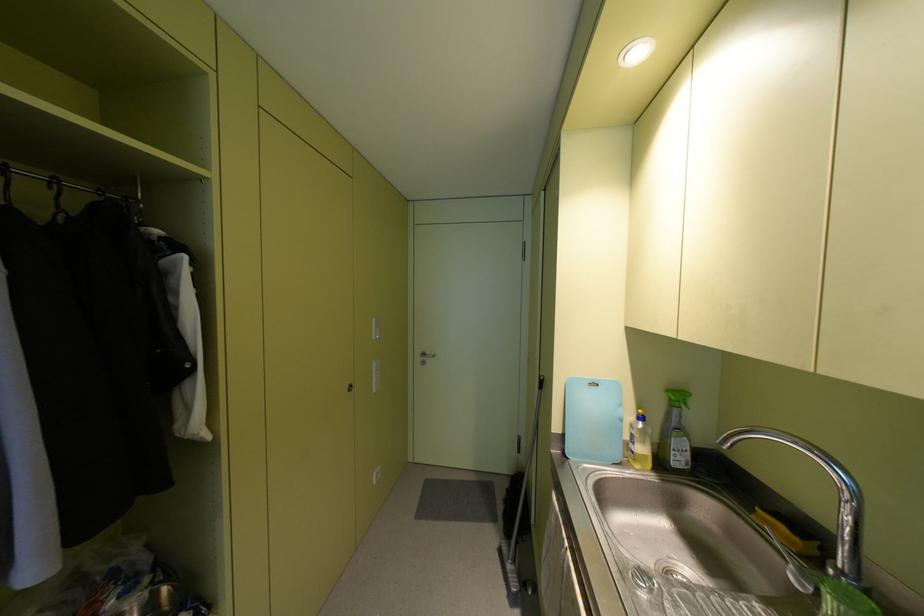
Locate an element on the screen. yellow soap dispenser is located at coordinates (639, 443).